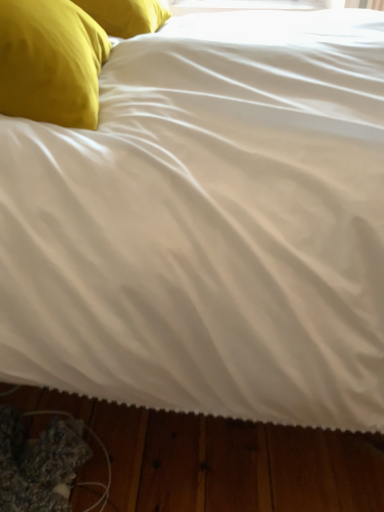
Image resolution: width=384 pixels, height=512 pixels. Describe the element at coordinates (50, 62) in the screenshot. I see `yellow fabric pillow at upper left, marked as the 1th pillow in a bottom-to-top arrangement` at that location.

Find the location of `yellow fabric pillow at upper left, which ranks as the 2th pillow in back-to-front order`. yellow fabric pillow at upper left, which ranks as the 2th pillow in back-to-front order is located at coordinates (50, 62).

At what (x,y) coordinates should I click in order to perform the action: click on matte yellow pillow at upper left, the first pillow positioned from the back. Please return your answer as a coordinate pair (x, y). This screenshot has height=512, width=384. Looking at the image, I should click on (126, 15).

How much space does matte yellow pillow at upper left, which appears as the 1th pillow when viewed from the top, occupy vertically?

5.25 inches.

Describe the element at coordinates (126, 15) in the screenshot. The width and height of the screenshot is (384, 512). I see `matte yellow pillow at upper left, which appears as the 1th pillow when viewed from the top` at that location.

Where is `yellow fabric pillow at upper left, the 1th pillow positioned from the front`? This screenshot has height=512, width=384. yellow fabric pillow at upper left, the 1th pillow positioned from the front is located at coordinates (50, 62).

Is yellow fabric pillow at upper left, the 2th pillow in the top-to-bottom sequence, at the right side of matte yellow pillow at upper left, which appears as the 1th pillow when viewed from the top?

No, yellow fabric pillow at upper left, the 2th pillow in the top-to-bottom sequence, is not to the right of matte yellow pillow at upper left, which appears as the 1th pillow when viewed from the top.

Between yellow fabric pillow at upper left, which ranks as the 2th pillow in back-to-front order, and matte yellow pillow at upper left, the first pillow positioned from the back, which one is positioned in front?

yellow fabric pillow at upper left, which ranks as the 2th pillow in back-to-front order, is closer to the camera.

Is point (70, 25) in front of point (159, 25)?

That is True.

From the image's perspective, is yellow fabric pillow at upper left, the 2th pillow in the top-to-bottom sequence, under matte yellow pillow at upper left, which appears as the 2th pillow when viewed from the front?

Correct, yellow fabric pillow at upper left, the 2th pillow in the top-to-bottom sequence, appears lower than matte yellow pillow at upper left, which appears as the 2th pillow when viewed from the front, in the image.

From a real-world perspective, does yellow fabric pillow at upper left, the 2th pillow in the top-to-bottom sequence, sit lower than matte yellow pillow at upper left, which appears as the 2th pillow when viewed from the front?

Actually, yellow fabric pillow at upper left, the 2th pillow in the top-to-bottom sequence, is physically above matte yellow pillow at upper left, which appears as the 2th pillow when viewed from the front, in the real world.

Between yellow fabric pillow at upper left, the 2th pillow in the top-to-bottom sequence, and matte yellow pillow at upper left, which appears as the 1th pillow when viewed from the top, which one has larger width?

Wider between the two is matte yellow pillow at upper left, which appears as the 1th pillow when viewed from the top.

Is yellow fabric pillow at upper left, the 2th pillow in the top-to-bottom sequence, taller or shorter than matte yellow pillow at upper left, which appears as the 2th pillow when viewed from the front?

Considering their sizes, yellow fabric pillow at upper left, the 2th pillow in the top-to-bottom sequence, has more height than matte yellow pillow at upper left, which appears as the 2th pillow when viewed from the front.

In terms of size, does yellow fabric pillow at upper left, the 1th pillow positioned from the front, appear bigger or smaller than matte yellow pillow at upper left, which appears as the 2th pillow when viewed from the front?

In the image, yellow fabric pillow at upper left, the 1th pillow positioned from the front, appears to be larger than matte yellow pillow at upper left, which appears as the 2th pillow when viewed from the front.

Is matte yellow pillow at upper left, which appears as the 2th pillow when viewed from the front, surrounded by yellow fabric pillow at upper left, the 2th pillow in the top-to-bottom sequence?

That's incorrect, matte yellow pillow at upper left, which appears as the 2th pillow when viewed from the front, is not inside yellow fabric pillow at upper left, the 2th pillow in the top-to-bottom sequence.

Are yellow fabric pillow at upper left, the 1th pillow positioned from the front, and matte yellow pillow at upper left, the first pillow positioned from the back, far apart?

They are positioned close to each other.

Is yellow fabric pillow at upper left, marked as the 1th pillow in a bottom-to-top arrangement, aimed at matte yellow pillow at upper left, the second pillow in the bottom-to-top sequence?

No.

Can you tell me how much yellow fabric pillow at upper left, which ranks as the 2th pillow in back-to-front order, and matte yellow pillow at upper left, which appears as the 2th pillow when viewed from the front, differ in facing direction?

They differ by 10.8 degrees in their facing directions.

This screenshot has width=384, height=512. I want to click on pillow on the right side of yellow fabric pillow at upper left, the 2th pillow in the top-to-bottom sequence, so click(x=126, y=15).

Does matte yellow pillow at upper left, the second pillow in the bottom-to-top sequence, appear on the left side of yellow fabric pillow at upper left, marked as the 1th pillow in a bottom-to-top arrangement?

No.

Is matte yellow pillow at upper left, which appears as the 1th pillow when viewed from the top, in front of yellow fabric pillow at upper left, marked as the 1th pillow in a bottom-to-top arrangement?

No, matte yellow pillow at upper left, which appears as the 1th pillow when viewed from the top, is further to the viewer.

Which is farther from the camera, (119, 20) or (50, 121)?

The point (119, 20) is behind.

From the image's perspective, between matte yellow pillow at upper left, the first pillow positioned from the back, and yellow fabric pillow at upper left, the 2th pillow in the top-to-bottom sequence, which one is located above?

From the image's view, matte yellow pillow at upper left, the first pillow positioned from the back, is above.

From a real-world perspective, who is located lower, matte yellow pillow at upper left, the second pillow in the bottom-to-top sequence, or yellow fabric pillow at upper left, the 1th pillow positioned from the front?

matte yellow pillow at upper left, the second pillow in the bottom-to-top sequence.

Can you confirm if matte yellow pillow at upper left, which appears as the 2th pillow when viewed from the front, is wider than yellow fabric pillow at upper left, the 2th pillow in the top-to-bottom sequence?

Yes.

Can you confirm if matte yellow pillow at upper left, the second pillow in the bottom-to-top sequence, is shorter than yellow fabric pillow at upper left, the 1th pillow positioned from the front?

Correct, matte yellow pillow at upper left, the second pillow in the bottom-to-top sequence, is not as tall as yellow fabric pillow at upper left, the 1th pillow positioned from the front.

From the picture: Looking at the image, does matte yellow pillow at upper left, which appears as the 2th pillow when viewed from the front, seem bigger or smaller compared to yellow fabric pillow at upper left, which ranks as the 2th pillow in back-to-front order?

Clearly, matte yellow pillow at upper left, which appears as the 2th pillow when viewed from the front, is smaller in size than yellow fabric pillow at upper left, which ranks as the 2th pillow in back-to-front order.

Which is correct: matte yellow pillow at upper left, the second pillow in the bottom-to-top sequence, is inside yellow fabric pillow at upper left, which ranks as the 2th pillow in back-to-front order, or outside of it?

matte yellow pillow at upper left, the second pillow in the bottom-to-top sequence, is spatially situated outside yellow fabric pillow at upper left, which ranks as the 2th pillow in back-to-front order.

Is matte yellow pillow at upper left, the second pillow in the bottom-to-top sequence, aimed at yellow fabric pillow at upper left, which ranks as the 2th pillow in back-to-front order?

No, matte yellow pillow at upper left, the second pillow in the bottom-to-top sequence, is not turned towards yellow fabric pillow at upper left, which ranks as the 2th pillow in back-to-front order.

This screenshot has width=384, height=512. Find the location of `pillow that appears below the matte yellow pillow at upper left, which appears as the 2th pillow when viewed from the front (from the image's perspective)`. pillow that appears below the matte yellow pillow at upper left, which appears as the 2th pillow when viewed from the front (from the image's perspective) is located at coordinates (50, 62).

You are a GUI agent. You are given a task and a screenshot of the screen. Output one action in this format:
    pyautogui.click(x=<x>, y=<y>)
    Task: Click on the pillow located in front of the matte yellow pillow at upper left, the second pillow in the bottom-to-top sequence
    This screenshot has width=384, height=512.
    Given the screenshot: What is the action you would take?
    pyautogui.click(x=50, y=62)

Where is `pillow behind the yellow fabric pillow at upper left, which ranks as the 2th pillow in back-to-front order`? This screenshot has height=512, width=384. pillow behind the yellow fabric pillow at upper left, which ranks as the 2th pillow in back-to-front order is located at coordinates (126, 15).